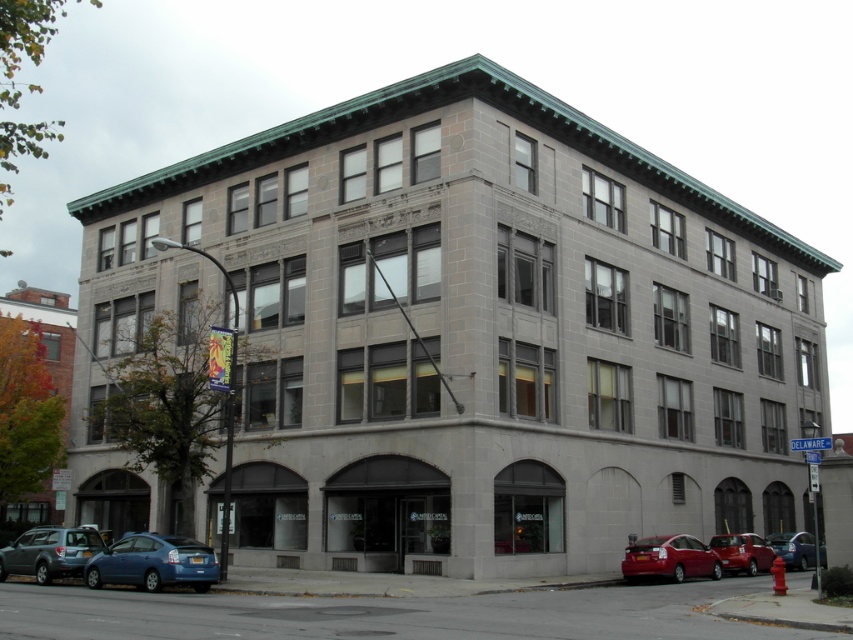
Question: Which point appears farthest from the camera in this image?

Choices:
 (A) (32, 566)
 (B) (795, 536)
 (C) (764, 566)
 (D) (682, 568)

Answer: (B)

Question: Which of the following is the farthest from the observer?

Choices:
 (A) (631, 561)
 (B) (733, 540)

Answer: (B)

Question: Considering the real-world distances, which object is farthest from the blue matte car at lower left?

Choices:
 (A) shiny red sedan at lower right
 (B) matte gray suv at lower left
 (C) metallic silver sedan at lower right
 (D) shiny red car at lower right

Answer: (C)

Question: Can you confirm if shiny red car at lower right is bigger than metallic silver sedan at lower right?

Choices:
 (A) yes
 (B) no

Answer: (A)

Question: Can you confirm if shiny red car at lower right is wider than metallic silver sedan at lower right?

Choices:
 (A) yes
 (B) no

Answer: (A)

Question: Can you confirm if matte gray suv at lower left is positioned below shiny red car at lower right?

Choices:
 (A) yes
 (B) no

Answer: (B)